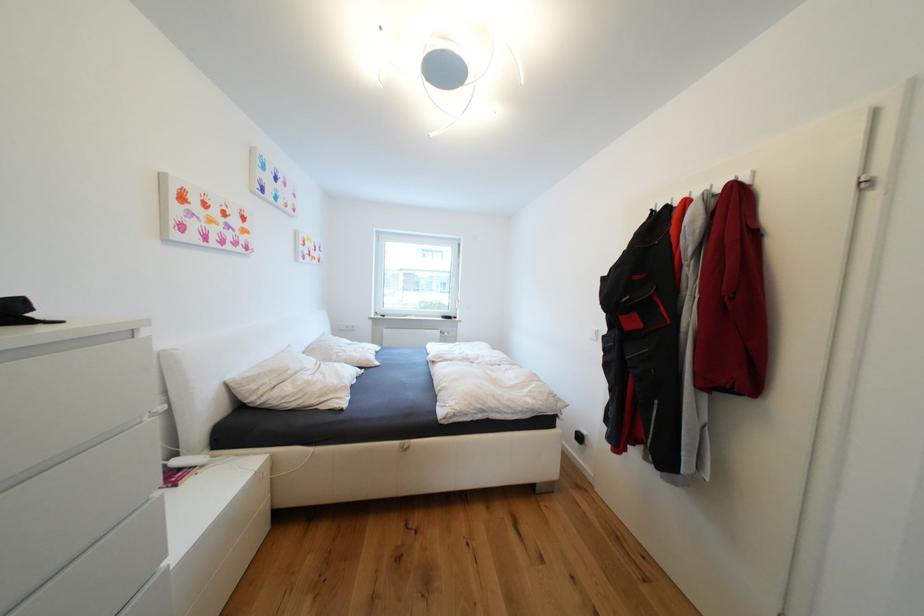
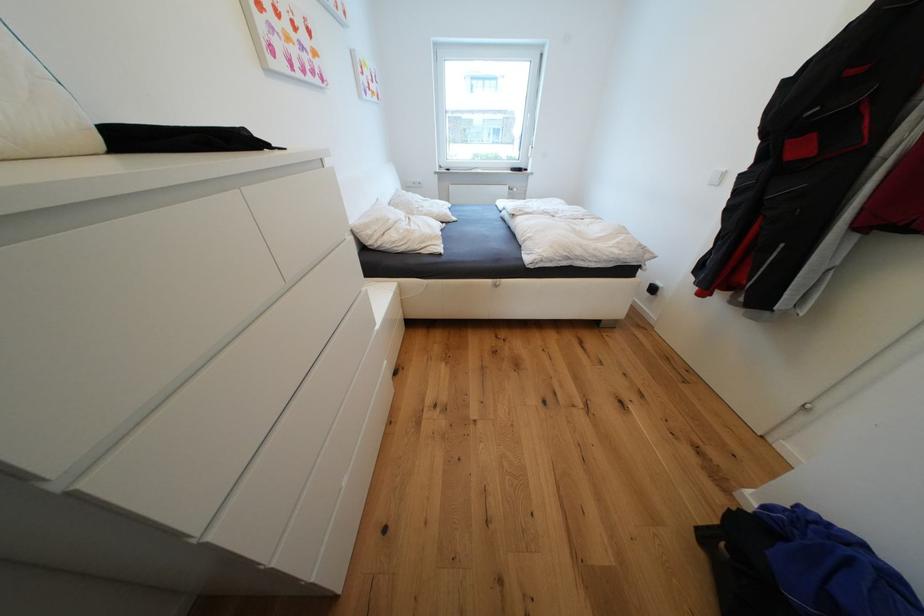
The point at (584, 445) is marked in the first image. Where is the corresponding point in the second image?

(653, 294)